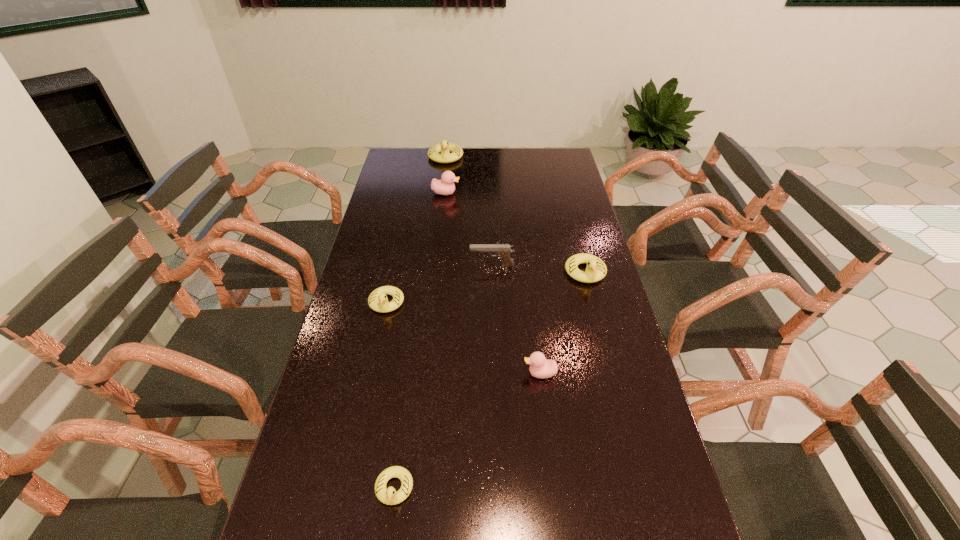
Image resolution: width=960 pixels, height=540 pixels. Identify the location of the second nearest yellow duckling. (378, 301).

The height and width of the screenshot is (540, 960). Identify the location of the nearest object. point(389,496).

Locate an element on the screen. Image resolution: width=960 pixels, height=540 pixels. the nearest duckling is located at coordinates (389, 496).

This screenshot has width=960, height=540. Identify the location of vacant position located 0.380m on the face of the biggest yellow duckling. (439, 216).

Find the location of `free point located 0.050m on the front-facing side of the second farthest duckling`. free point located 0.050m on the front-facing side of the second farthest duckling is located at coordinates (472, 193).

Identify the location of free space located at the barrel of the third object from right to left. Image resolution: width=960 pixels, height=540 pixels. (452, 266).

Where is `vacant space located at the barrel of the third object from right to left`? The height and width of the screenshot is (540, 960). vacant space located at the barrel of the third object from right to left is located at coordinates (429, 266).

Locate an element on the screen. free space located at the barrel of the third object from right to left is located at coordinates (414, 266).

The width and height of the screenshot is (960, 540). In order to click on free spot located on the face of the second biggest yellow duckling in this screenshot , I will do `click(602, 336)`.

The image size is (960, 540). I want to click on vacant space located on the front-facing side of the second object from right to left, so click(x=478, y=373).